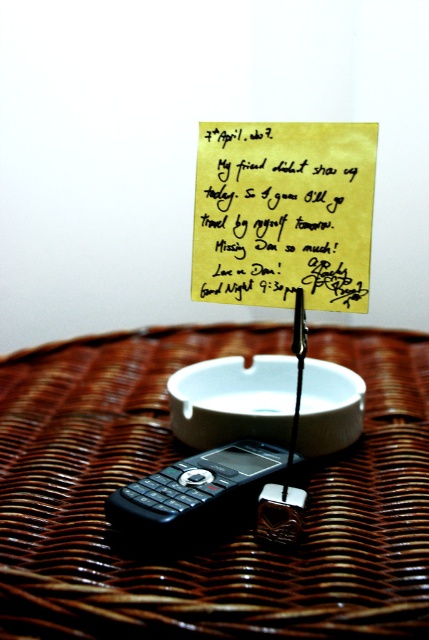
Can you confirm if yellow paper at center is taller than black plastic phone at center?

Correct, yellow paper at center is much taller as black plastic phone at center.

This screenshot has height=640, width=429. Identify the location of yellow paper at center. (283, 212).

Does woven brown table at center appear on the right side of yellow paper at center?

No, woven brown table at center is not to the right of yellow paper at center.

Is point (9, 426) positioned behind point (257, 220)?

Yes, it is behind point (257, 220).

Does point (323, 624) come closer to viewer compared to point (229, 280)?

Yes, it is.

Locate an element on the screen. woven brown table at center is located at coordinates (224, 525).

Which is below, woven brown table at center or black plastic phone at center?

black plastic phone at center is lower down.

This screenshot has width=429, height=640. What do you see at coordinates (224, 525) in the screenshot?
I see `woven brown table at center` at bounding box center [224, 525].

What are the coordinates of `woven brown table at center` in the screenshot? It's located at (224, 525).